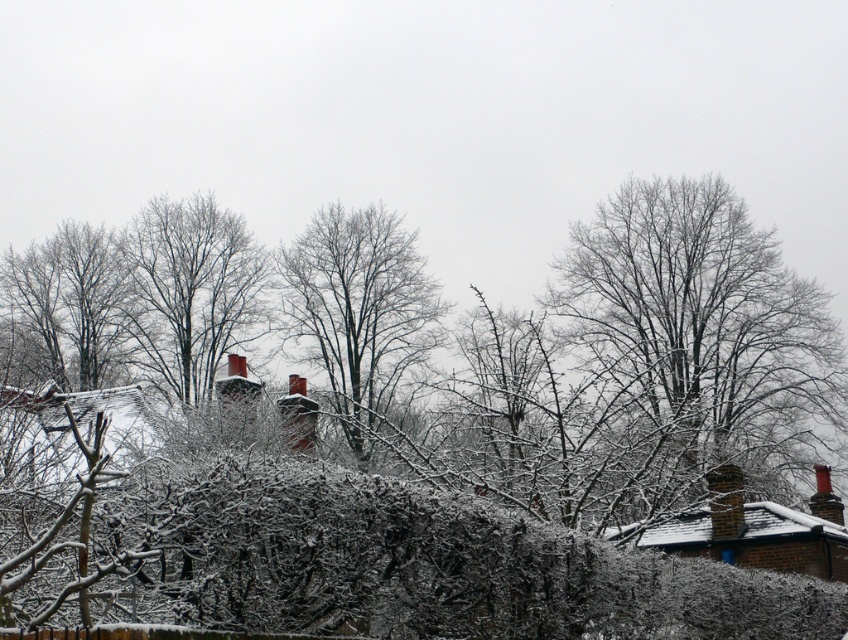
You are an artist sketching the winter scene. You need to draw the bare branches at center and the bare wood tree at center. Which one should you draw first if you want to follow the rule of drawing smaller objects before larger ones?

The bare branches at center is smaller than the bare wood tree at center, so you should draw the bare branches at center first.

You are standing in the winter scene and want to walk from the bare wood tree at center to the bare branches at upper right. Which direction should you head towards?

The bare branches at upper right is positioned on the right side of the bare wood tree at center, so you should head towards the right direction.